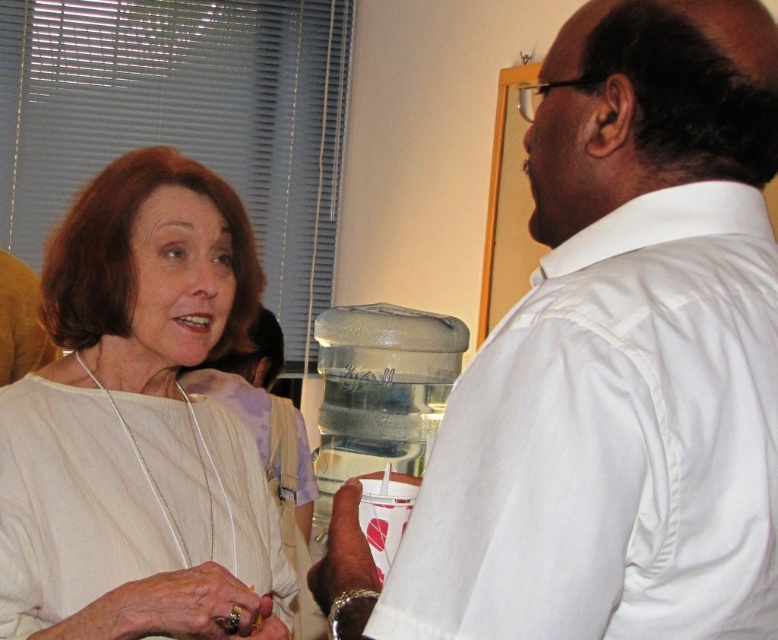
Is point (83, 474) more distant than point (310, 568)?

Yes, it is behind point (310, 568).

Between white matte necklace at upper left and brown leather wristband at lower center, which one has less height?

Standing shorter between the two is brown leather wristband at lower center.

Does point (160, 294) come behind point (345, 582)?

Yes, point (160, 294) is farther from viewer.

Identify the location of white matte necklace at upper left. This screenshot has width=778, height=640. (135, 413).

Who is taller, brown leather wristband at lower center or gold metallic ring at lower left?

gold metallic ring at lower left is taller.

Is brown leather wristband at lower center positioned behind gold metallic ring at lower left?

No, brown leather wristband at lower center is in front of gold metallic ring at lower left.

Between point (356, 531) and point (268, 636), which one is positioned in front?

Point (356, 531) is more forward.

At what (x,y) coordinates should I click in order to perform the action: click on brown leather wristband at lower center. Please return your answer as a coordinate pair (x, y). The width and height of the screenshot is (778, 640). Looking at the image, I should click on (342, 552).

Does white smooth shirt at right have a greater height compared to white matte necklace at upper left?

No.

This screenshot has height=640, width=778. What do you see at coordinates (619, 358) in the screenshot?
I see `white smooth shirt at right` at bounding box center [619, 358].

Identify the location of white smooth shirt at right. Image resolution: width=778 pixels, height=640 pixels. (619, 358).